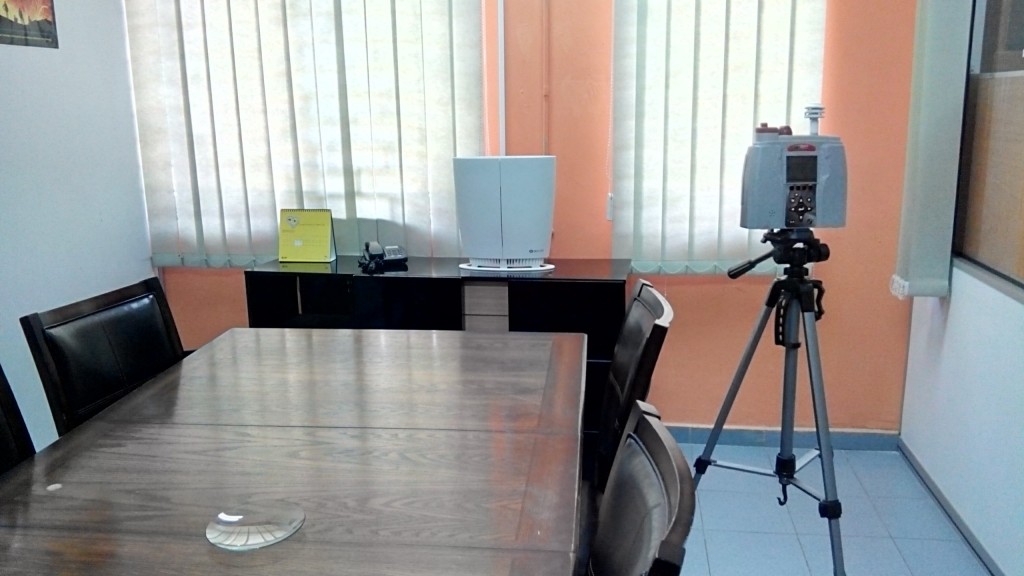
Find the location of a particular element. The width and height of the screenshot is (1024, 576). vertical white blinds is located at coordinates (313, 86), (730, 78).